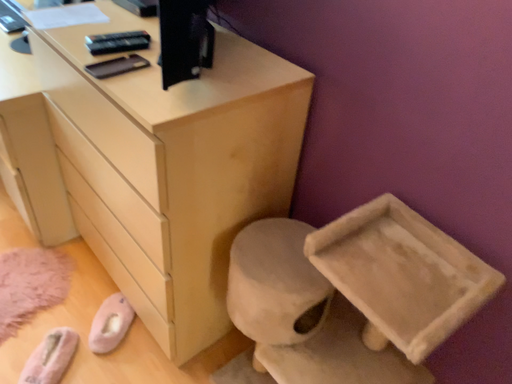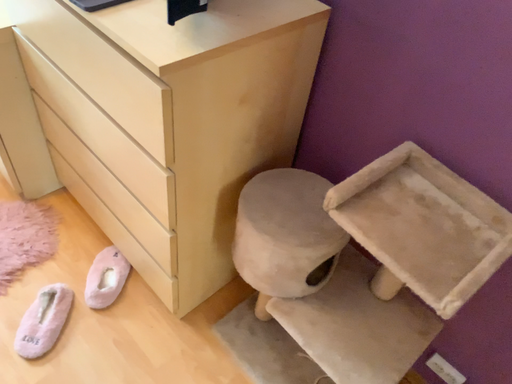
Question: Which way did the camera rotate in the video?

Choices:
 (A) rotated upward
 (B) rotated downward

Answer: (B)